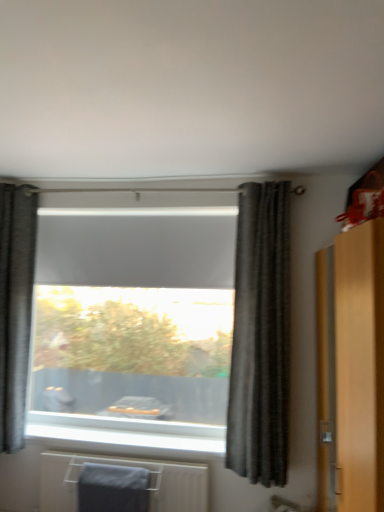
Question: Is matte wooden dresser at right not within dark gray textured curtain at center, placed as the 2th curtain when sorted from left to right?

Choices:
 (A) yes
 (B) no

Answer: (A)

Question: Does matte wooden dresser at right lie behind dark gray textured curtain at center, acting as the first curtain starting from the front?

Choices:
 (A) yes
 (B) no

Answer: (B)

Question: From a real-world perspective, is matte wooden dresser at right beneath dark gray textured curtain at center, which is the second curtain from back to front?

Choices:
 (A) no
 (B) yes

Answer: (B)

Question: From a real-world perspective, does matte wooden dresser at right stand above dark gray textured curtain at center, which is the second curtain from back to front?

Choices:
 (A) no
 (B) yes

Answer: (A)

Question: Is matte wooden dresser at right facing towards dark gray textured curtain at center, which is the second curtain from back to front?

Choices:
 (A) no
 (B) yes

Answer: (B)

Question: In the image, is dark gray textured curtain at center, which appears as the first curtain when viewed from the right, positioned in front of or behind dark gray textured curtain at left, marked as the 1th curtain in a back-to-front arrangement?

Choices:
 (A) front
 (B) behind

Answer: (A)

Question: From their relative heights in the image, would you say dark gray textured curtain at center, which appears as the first curtain when viewed from the right, is taller or shorter than dark gray textured curtain at left, marked as the 1th curtain in a back-to-front arrangement?

Choices:
 (A) tall
 (B) short

Answer: (B)

Question: Is dark gray textured curtain at center, placed as the 2th curtain when sorted from left to right, wider or thinner than dark gray textured curtain at left, arranged as the second curtain when viewed from the right?

Choices:
 (A) wide
 (B) thin

Answer: (A)

Question: Is dark gray textured curtain at center, placed as the 2th curtain when sorted from left to right, bigger or smaller than dark gray textured curtain at left, the first curtain positioned from the left?

Choices:
 (A) big
 (B) small

Answer: (A)

Question: From the image's perspective, is matte wooden dresser at right above or below dark gray textured curtain at center, which is the second curtain from back to front?

Choices:
 (A) above
 (B) below

Answer: (B)

Question: In the image, is matte wooden dresser at right positioned in front of or behind dark gray textured curtain at center, which appears as the first curtain when viewed from the right?

Choices:
 (A) behind
 (B) front

Answer: (B)

Question: From their relative heights in the image, would you say matte wooden dresser at right is taller or shorter than dark gray textured curtain at center, placed as the 2th curtain when sorted from left to right?

Choices:
 (A) short
 (B) tall

Answer: (A)

Question: In terms of width, does matte wooden dresser at right look wider or thinner when compared to dark gray textured curtain at center, acting as the first curtain starting from the front?

Choices:
 (A) wide
 (B) thin

Answer: (A)

Question: Would you say gray fabric bath towel at lower left is to the left or to the right of dark gray textured curtain at center, which is the second curtain from back to front, in the picture?

Choices:
 (A) right
 (B) left

Answer: (B)

Question: Is gray fabric bath towel at lower left taller or shorter than dark gray textured curtain at center, acting as the first curtain starting from the front?

Choices:
 (A) short
 (B) tall

Answer: (A)